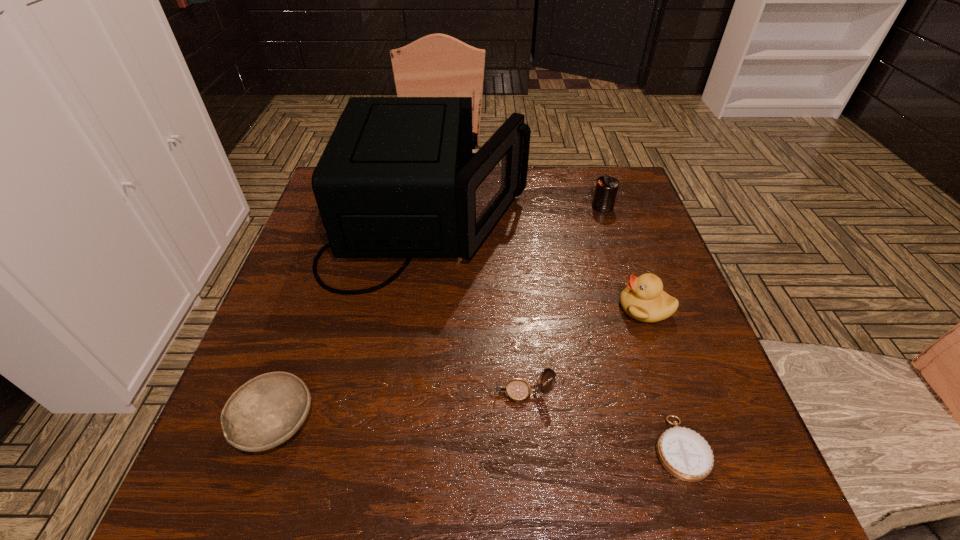
Locate an element on the screen. This screenshot has width=960, height=540. microwave oven is located at coordinates (398, 178).

Where is `can`? can is located at coordinates (606, 189).

Locate an element on the screen. duckling is located at coordinates (643, 299).

This screenshot has height=540, width=960. What are the coordinates of `the left compass` in the screenshot? It's located at (517, 390).

Locate an element on the screen. This screenshot has width=960, height=540. the farther compass is located at coordinates (517, 390).

At what (x,y) coordinates should I click in order to perform the action: click on bowl. Please return your answer as a coordinate pair (x, y). This screenshot has height=540, width=960. Looking at the image, I should click on (266, 411).

At what (x,y) coordinates should I click in order to perform the action: click on the right compass. Please return your answer as a coordinate pair (x, y). Looking at the image, I should click on (685, 454).

Identify the location of the shortest object. (685, 454).

Identify the location of blank space located 0.300m with the door open on the tallest object. (638, 222).

Find the location of a particular element. vacant region located on the back of the can is located at coordinates (590, 170).